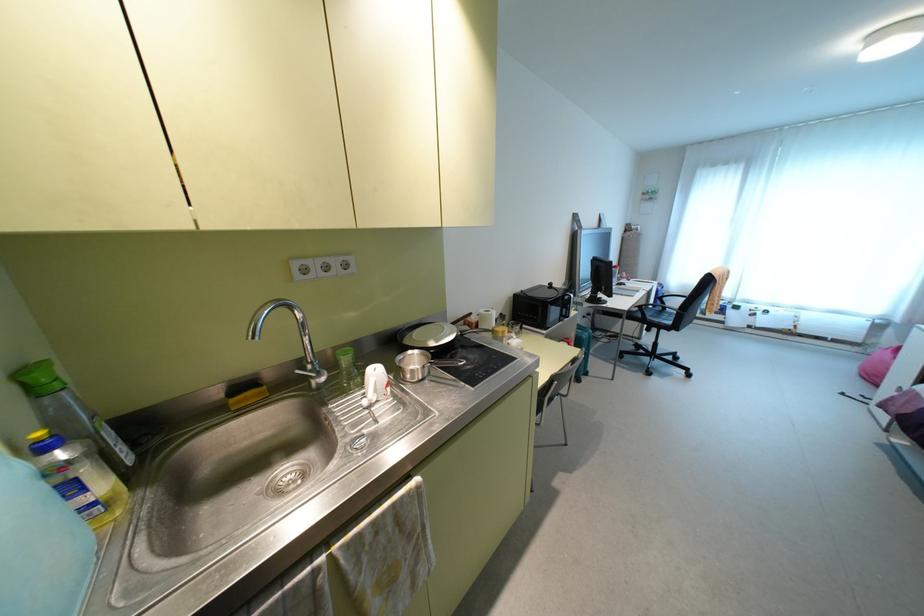
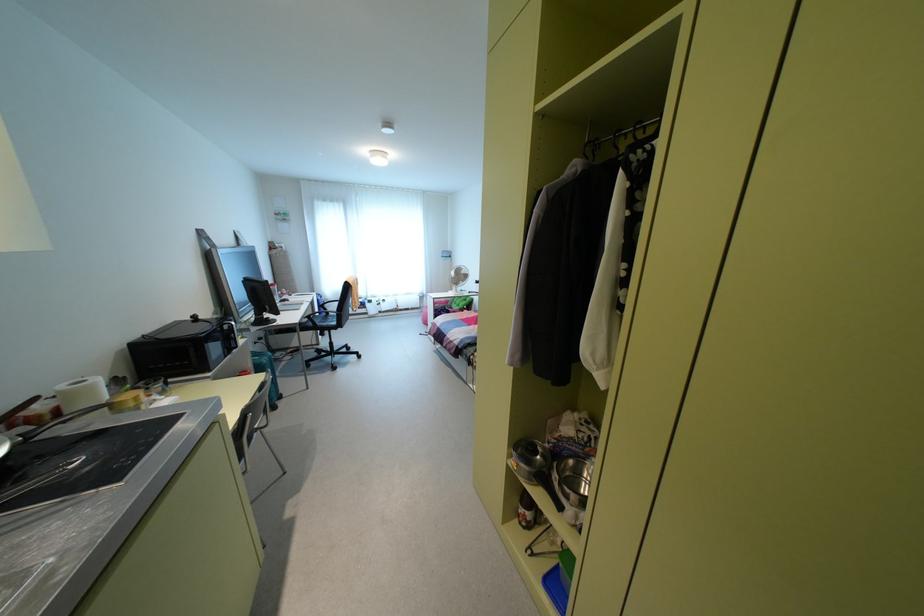
Where in the second image is the point corresponding to point 480,310 from the first image?

(62, 387)